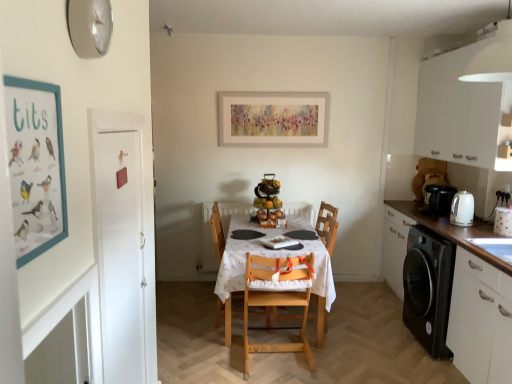
Question: Can you confirm if white matte door at left is shorter than white matte cabinet at upper right, which is counted as the 1th cabinetry, starting from the top?

Choices:
 (A) yes
 (B) no

Answer: (B)

Question: Does white matte door at left have a greater height compared to white matte cabinet at upper right, which is the 2th cabinetry in bottom-to-top order?

Choices:
 (A) no
 (B) yes

Answer: (B)

Question: From a real-world perspective, is white matte door at left positioned under white matte cabinet at upper right, which is the 2th cabinetry in bottom-to-top order, based on gravity?

Choices:
 (A) yes
 (B) no

Answer: (A)

Question: From the image's perspective, does white matte door at left appear higher than white matte cabinet at upper right, which is the 2th cabinetry in bottom-to-top order?

Choices:
 (A) yes
 (B) no

Answer: (B)

Question: Is white matte door at left at the left side of white matte cabinet at upper right, which is the 2th cabinetry in bottom-to-top order?

Choices:
 (A) yes
 (B) no

Answer: (A)

Question: From a real-world perspective, is wooden chair at center, acting as the second chair starting from the front, physically located above or below white matte door at left?

Choices:
 (A) above
 (B) below

Answer: (B)

Question: In terms of width, does wooden chair at center, which is counted as the first chair, starting from the back, look wider or thinner when compared to white matte door at left?

Choices:
 (A) wide
 (B) thin

Answer: (A)

Question: In terms of size, does wooden chair at center, acting as the second chair starting from the front, appear bigger or smaller than white matte door at left?

Choices:
 (A) big
 (B) small

Answer: (A)

Question: Is point (214, 243) positioned closer to the camera than point (113, 370)?

Choices:
 (A) farther
 (B) closer

Answer: (A)

Question: In terms of size, does white glossy cabinet at lower right, the 1th cabinetry in the bottom-to-top sequence, appear bigger or smaller than white matte drawer at lower right?

Choices:
 (A) big
 (B) small

Answer: (A)

Question: In terms of height, does white glossy cabinet at lower right, the 1th cabinetry in the bottom-to-top sequence, look taller or shorter compared to white matte drawer at lower right?

Choices:
 (A) short
 (B) tall

Answer: (B)

Question: Based on their positions, is white glossy cabinet at lower right, which is counted as the second cabinetry, starting from the top, located to the left or right of white matte drawer at lower right?

Choices:
 (A) left
 (B) right

Answer: (B)

Question: Is white glossy cabinet at lower right, which is counted as the second cabinetry, starting from the top, inside or outside of white matte drawer at lower right?

Choices:
 (A) outside
 (B) inside

Answer: (A)

Question: Is white wood table at center taller or shorter than matte cardboard poster at left?

Choices:
 (A) short
 (B) tall

Answer: (B)

Question: Choose the correct answer: Is white wood table at center inside matte cardboard poster at left or outside it?

Choices:
 (A) inside
 (B) outside

Answer: (B)